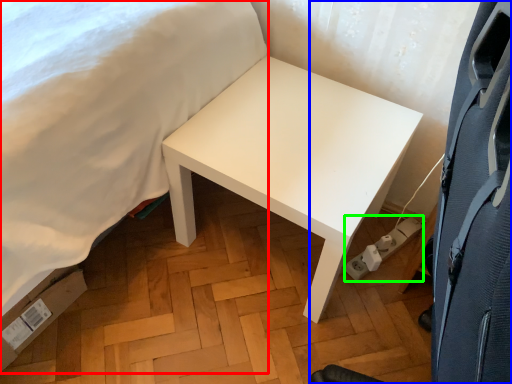
Question: Estimate the real-world distances between objects in this image. Which object is closer to bed (highlighted by a red box), swivel chair (highlighted by a blue box) or electric outlet (highlighted by a green box)?

Choices:
 (A) swivel chair
 (B) electric outlet

Answer: (A)